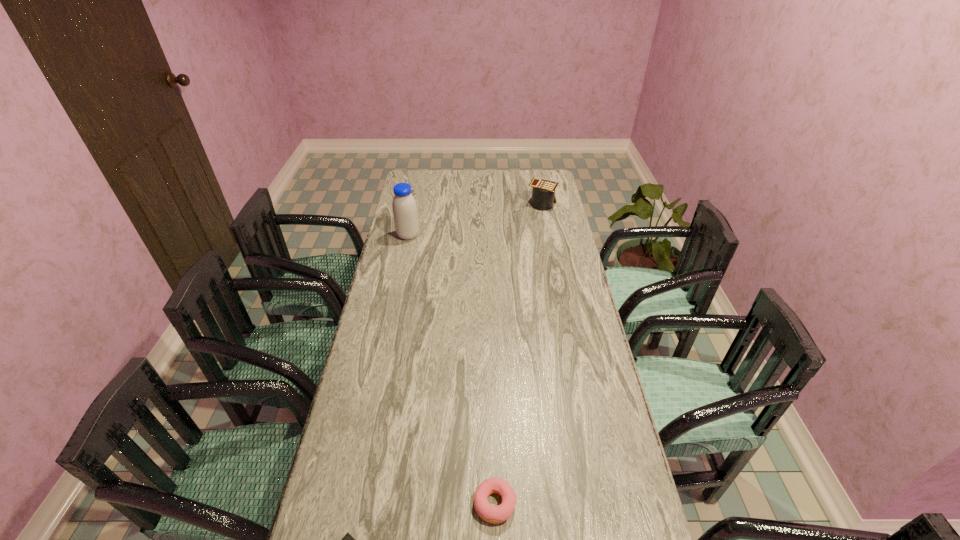
Find the location of a particular element. The width and height of the screenshot is (960, 540). soya milk is located at coordinates (404, 207).

Where is `the tallest object`? This screenshot has height=540, width=960. the tallest object is located at coordinates coord(404,207).

Find the location of `the farther calculator`. the farther calculator is located at coordinates (543, 193).

I want to click on the rightmost object, so click(x=543, y=193).

The image size is (960, 540). I want to click on doughnut, so click(493, 514).

Locate an element on the screen. The image size is (960, 540). the second shortest object is located at coordinates [x=493, y=514].

You are a GUI agent. You are given a task and a screenshot of the screen. Output one action in this format:
    pyautogui.click(x=<x>, y=<y>)
    Task: Click on the free location located on the front of the soya milk
    
    Given the screenshot: What is the action you would take?
    pyautogui.click(x=402, y=264)

Where is `vacant area located on the left of the rightmost object`? Image resolution: width=960 pixels, height=540 pixels. vacant area located on the left of the rightmost object is located at coordinates (446, 204).

Locate an element on the screen. This screenshot has height=540, width=960. vacant region located 0.360m on the back of the second nearest object is located at coordinates (492, 368).

The image size is (960, 540). In order to click on object positioned at the left edge in this screenshot , I will do `click(404, 207)`.